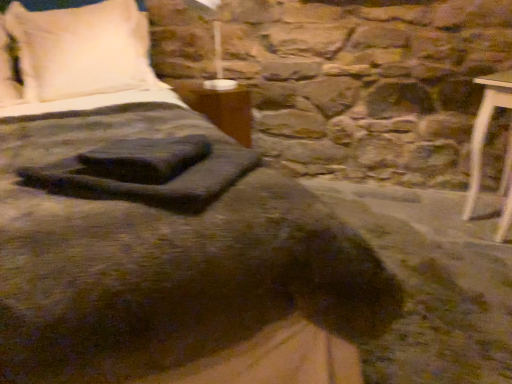
Question: From a real-world perspective, is wooden table at center physically located above or below matte white lampshade at upper center?

Choices:
 (A) above
 (B) below

Answer: (B)

Question: Considering their positions, is wooden table at center located in front of or behind matte white lampshade at upper center?

Choices:
 (A) front
 (B) behind

Answer: (B)

Question: Estimate the real-world distances between objects in this image. Which object is farther from the white soft pillow at upper left?

Choices:
 (A) wooden table at center
 (B) matte white lampshade at upper center

Answer: (B)

Question: Which object is the closest to the matte white lampshade at upper center?

Choices:
 (A) wooden table at center
 (B) white soft pillow at upper left

Answer: (A)